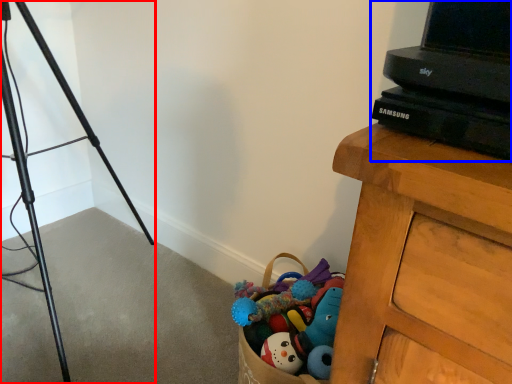
Question: Which point is further to the camera, tripod (highlighted by a red box) or computer (highlighted by a blue box)?

Choices:
 (A) tripod
 (B) computer

Answer: (A)